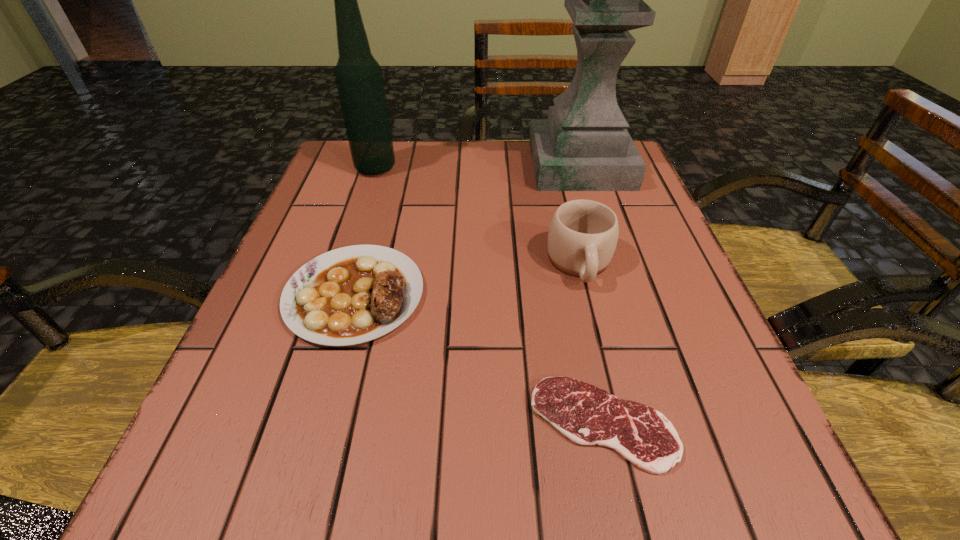
Find the location of `mug present at the right edge`. mug present at the right edge is located at coordinates (583, 234).

Identify the location of steak present at the right edge. This screenshot has width=960, height=540. (587, 415).

The width and height of the screenshot is (960, 540). I want to click on object at the far left corner, so click(x=359, y=79).

Find the location of a particular element. The height and width of the screenshot is (540, 960). object that is positioned at the far right corner is located at coordinates (584, 145).

At what (x,y) coordinates should I click in order to perform the action: click on object that is at the near right corner. Please return your answer as a coordinate pair (x, y). The width and height of the screenshot is (960, 540). Looking at the image, I should click on (587, 415).

The height and width of the screenshot is (540, 960). Find the location of `vacant space at the far edge of the desktop`. vacant space at the far edge of the desktop is located at coordinates (488, 152).

You are a GUI agent. You are given a task and a screenshot of the screen. Output one action in this format:
    pyautogui.click(x=<x>, y=<y>)
    Task: Click on the blank space at the near edge
    The image size is (960, 540).
    Given the screenshot: What is the action you would take?
    pyautogui.click(x=322, y=517)

Locate an element on the screen. This screenshot has width=960, height=540. vacant area at the left edge of the desktop is located at coordinates (313, 404).

You are a GUI agent. You are given a task and a screenshot of the screen. Output one action in this format:
    pyautogui.click(x=<x>, y=<y>)
    Task: Click on the vacant region at the right edge of the desktop
    
    Given the screenshot: What is the action you would take?
    pyautogui.click(x=619, y=205)

At what (x,y) coordinates should I click in order to perform the action: click on free region at the far left corner of the desktop. Please return your answer as a coordinate pair (x, y). This screenshot has height=540, width=960. Looking at the image, I should click on (343, 154).